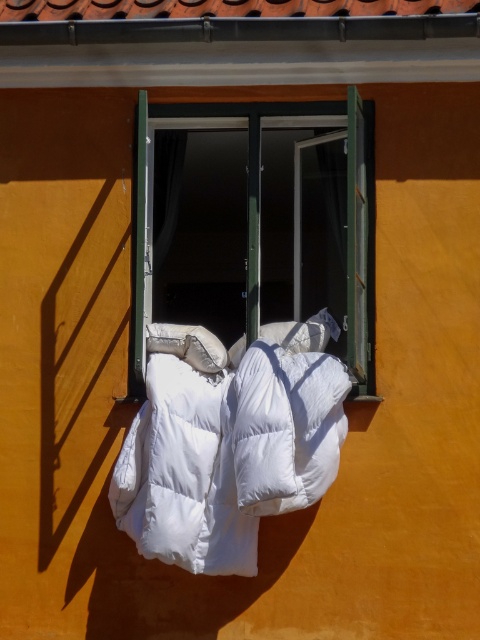
Between point (214, 403) and point (268, 364), which one is positioned in front?

Positioned in front is point (268, 364).

Does point (159, 424) come in front of point (288, 392)?

That is False.

In order to click on white down-filled blanket at center in this screenshot , I will do `click(183, 474)`.

Does green plastic window at center appear on the right side of white down-filled blanket at center?

Indeed, green plastic window at center is positioned on the right side of white down-filled blanket at center.

Does point (160, 269) come behind point (156, 474)?

Yes, it is behind point (156, 474).

Locate an element on the screen. The image size is (480, 640). green plastic window at center is located at coordinates (255, 221).

Between green plastic window at center and white down-filled sleeping bag at center, which one is positioned lower?

Positioned lower is white down-filled sleeping bag at center.

Which is more to the right, green plastic window at center or white down-filled sleeping bag at center?

Positioned to the right is white down-filled sleeping bag at center.

At what (x,y) coordinates should I click in order to perform the action: click on green plastic window at center. Please return your answer as a coordinate pair (x, y). The width and height of the screenshot is (480, 640). Looking at the image, I should click on (255, 221).